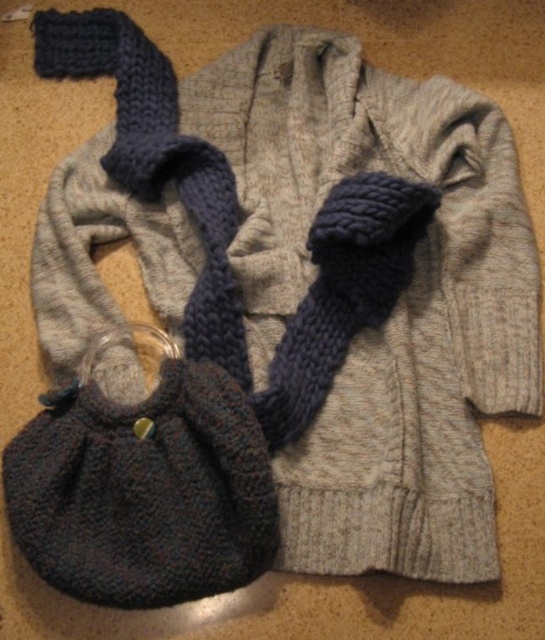
Question: Can you confirm if knitted dark gray purse at lower left is smaller than dark blue knitted scarf at center?

Choices:
 (A) no
 (B) yes

Answer: (B)

Question: Is knitted dark gray purse at lower left further to the viewer compared to dark blue knitted scarf at center?

Choices:
 (A) no
 (B) yes

Answer: (A)

Question: Which object appears farthest from the camera in this image?

Choices:
 (A) knitted dark gray purse at lower left
 (B) dark blue knitted scarf at center

Answer: (B)

Question: Does knitted dark gray purse at lower left have a smaller size compared to dark blue knitted scarf at center?

Choices:
 (A) yes
 (B) no

Answer: (A)

Question: Which point appears closest to the camera in this image?

Choices:
 (A) (137, 173)
 (B) (62, 522)

Answer: (B)